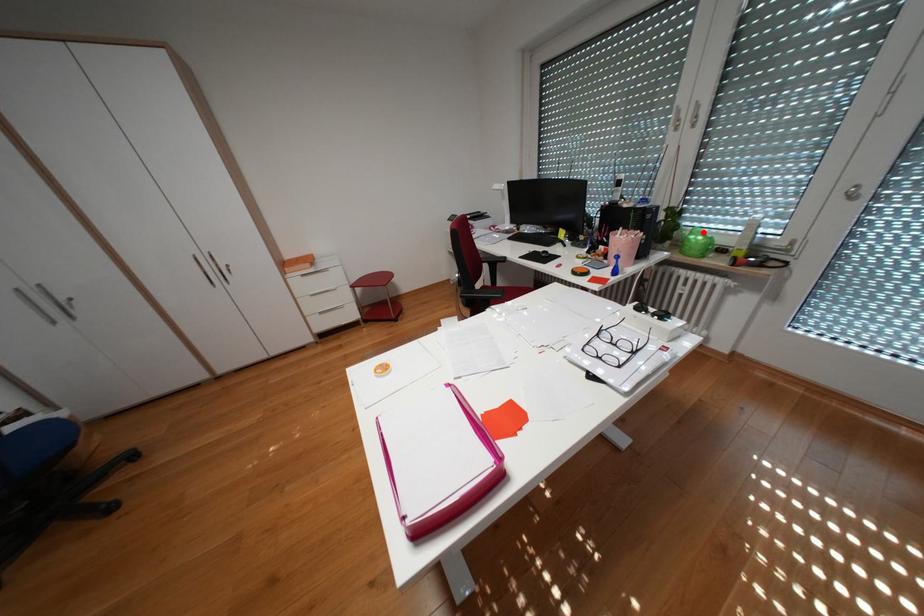
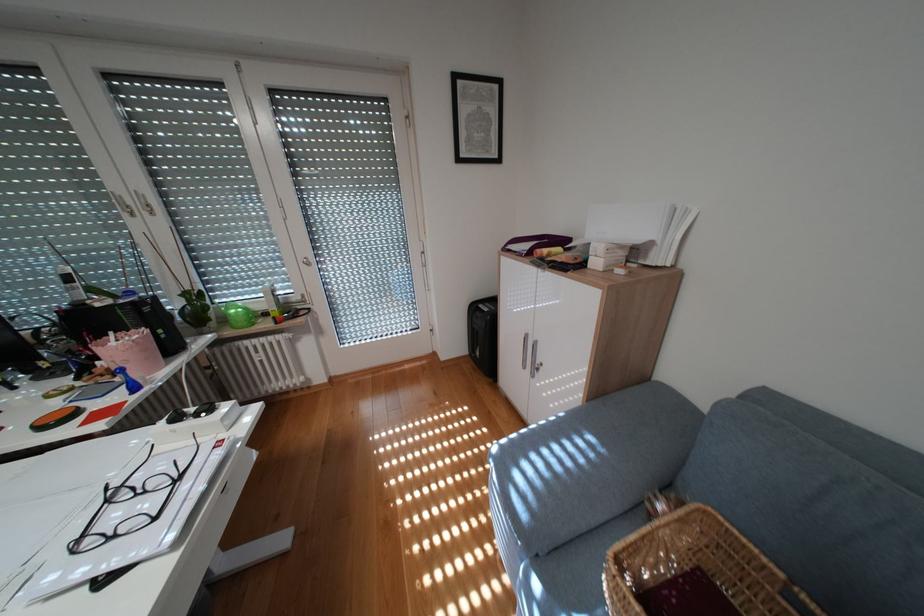
Where in the second image is the point corresponding to the highlighted location from the first image?

(239, 308)